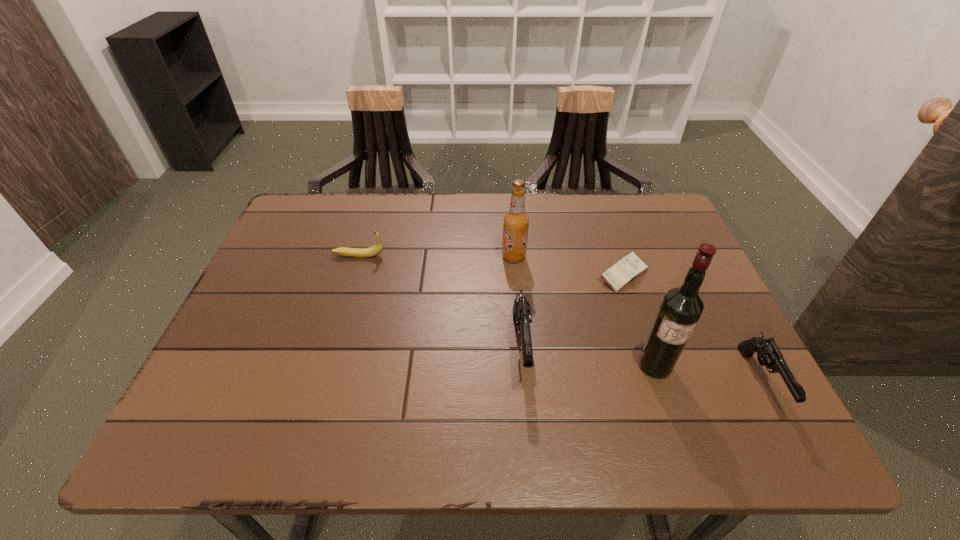
Identify the location of vacant spot to place a gun on the left. (311, 318).